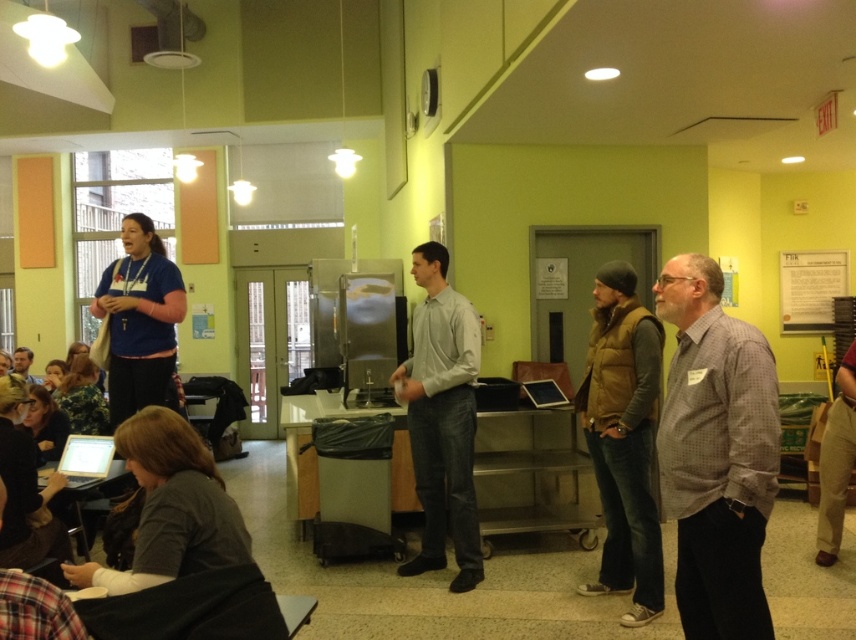
Can you confirm if gray checkered shirt at center is positioned to the right of light gray shirt at center?

Indeed, gray checkered shirt at center is positioned on the right side of light gray shirt at center.

Is gray checkered shirt at center above light gray shirt at center?

Yes.

The height and width of the screenshot is (640, 856). Identify the location of gray checkered shirt at center. click(x=716, y=452).

Is brown suede vest at center thinner than matte black shirt at lower left?

Yes, brown suede vest at center is thinner than matte black shirt at lower left.

Who is positioned more to the left, brown suede vest at center or matte black shirt at lower left?

Positioned to the left is matte black shirt at lower left.

Which is behind, point (619, 438) or point (21, 348)?

The point (21, 348) is behind.

Locate an element on the screen. Image resolution: width=856 pixels, height=640 pixels. brown suede vest at center is located at coordinates (623, 440).

Does light gray shirt at center have a larger size compared to matte black shirt at lower left?

Correct, light gray shirt at center is larger in size than matte black shirt at lower left.

Between point (441, 557) and point (18, 365), which one is positioned behind?

Positioned behind is point (18, 365).

This screenshot has width=856, height=640. In order to click on light gray shirt at center in this screenshot , I will do (x=443, y=419).